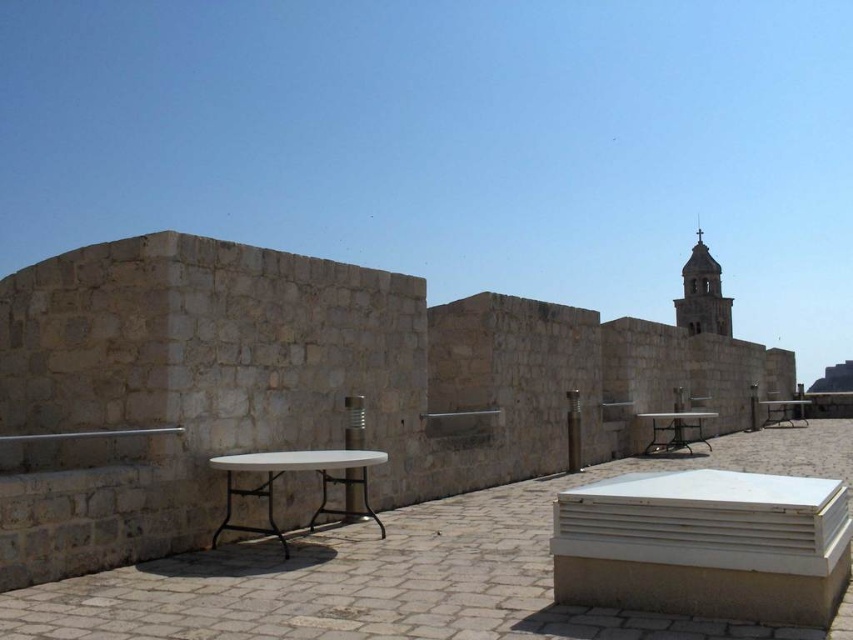
Question: Which object is closer to the camera taking this photo?

Choices:
 (A) metallic silver table at center
 (B) metallic silver chair at center-right
 (C) white metal table at center
 (D) white plastic table at left

Answer: (D)

Question: Where is metallic silver table at center located in relation to white metal table at center in the image?

Choices:
 (A) right
 (B) left

Answer: (B)

Question: Which object is closer to the camera taking this photo?

Choices:
 (A) white metal table at center
 (B) white plastic table at left

Answer: (B)

Question: Is the position of white metal table at center more distant than that of metallic silver chair at center-right?

Choices:
 (A) yes
 (B) no

Answer: (B)

Question: Which object is the farthest from the metallic silver chair at center-right?

Choices:
 (A) white metal table at center
 (B) white plastic table at left

Answer: (B)

Question: Can you confirm if white metal table at center is thinner than metallic silver chair at center-right?

Choices:
 (A) yes
 (B) no

Answer: (B)